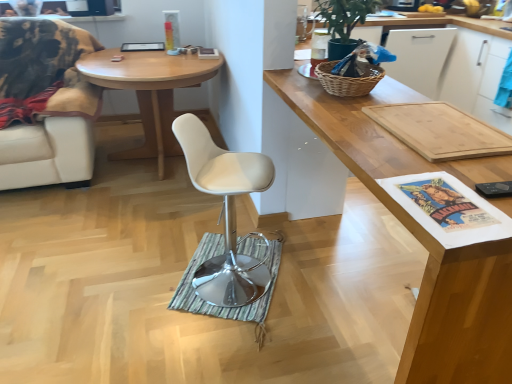
At what (x,y) coordinates should I click in order to perform the action: click on vacant area that lies between wooden cutting board at upper right and green striped mat at center. Please return your answer as a coordinate pair (x, y). Image resolution: width=512 pixels, height=384 pixels. Looking at the image, I should click on (261, 332).